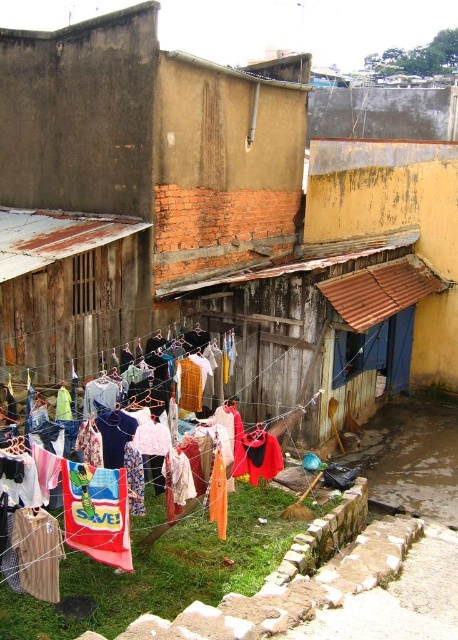
You are standing on the ground looking at the clothesline in the residential area. Which object is higher up between the red fabric banner at center and the red fabric towel at center?

The red fabric banner at center is located above the red fabric towel at center, so the red fabric banner at center is higher up.

You are standing in front of the clothesline in the residential area. You see a red fabric banner at center and a red fabric towel at center. Which one is positioned to the right?

The red fabric banner at center is to the right of the red fabric towel at center.